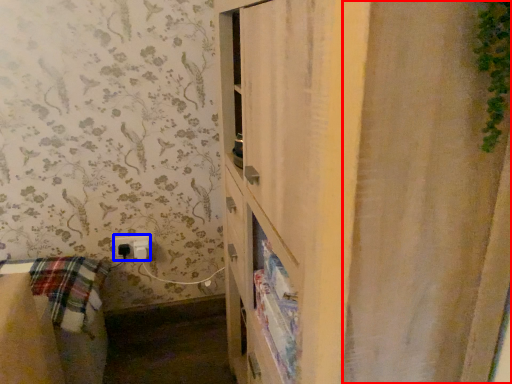
Question: Which of the following is the farthest to the observer, shower curtain (highlighted by a red box) or electric outlet (highlighted by a blue box)?

Choices:
 (A) shower curtain
 (B) electric outlet

Answer: (B)